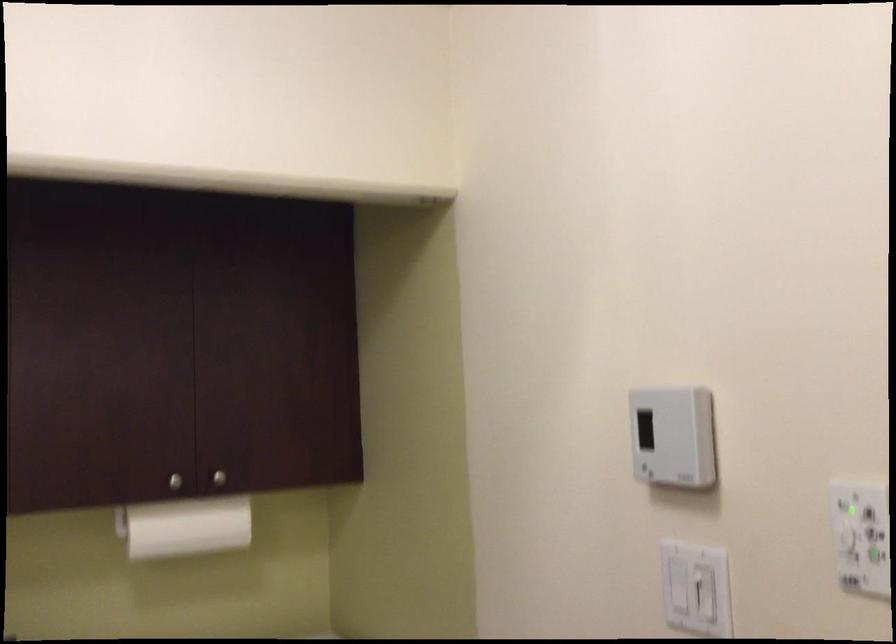
Find where to turn the control panel dial. Please return your answer as a coordinate pair (x, y).

(860, 536)